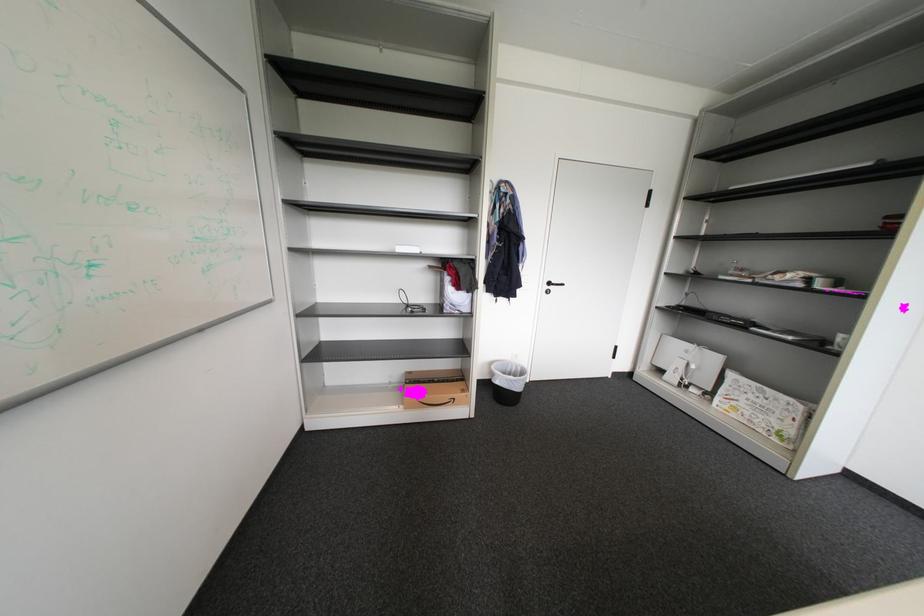
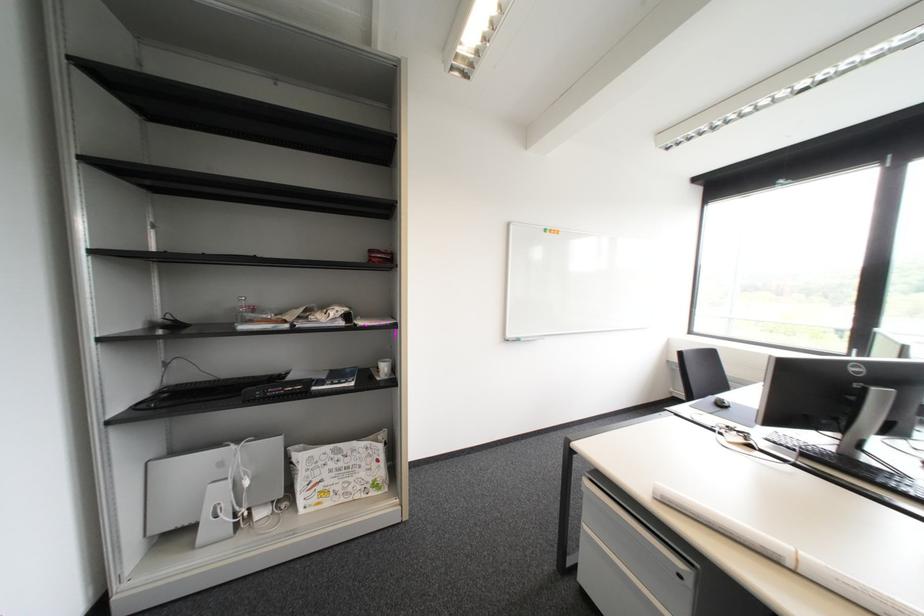
In the second image, find the point that corresponds to (758,400) in the first image.

(341, 472)